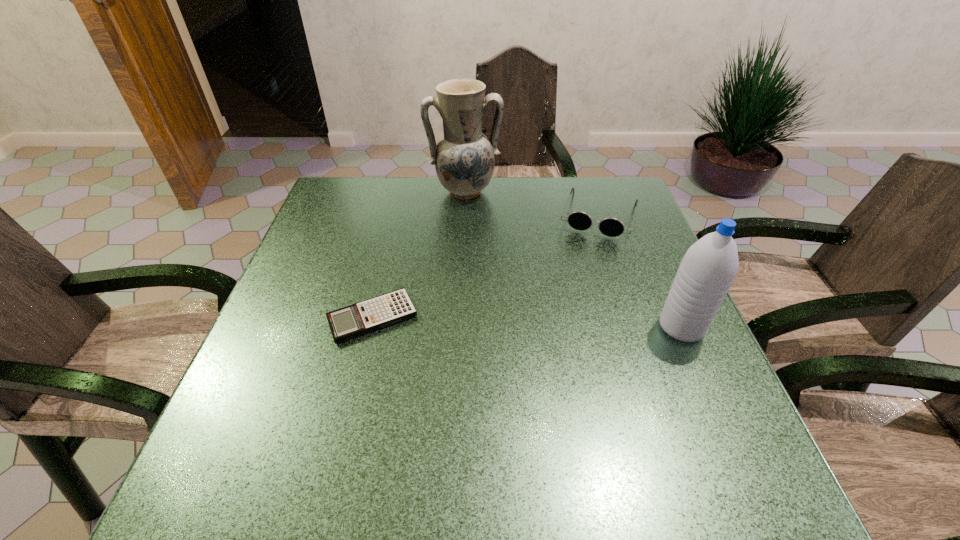
In order to click on the shortest object in this screenshot , I will do `click(379, 312)`.

Locate an element on the screen. Image resolution: width=960 pixels, height=540 pixels. the second tallest object is located at coordinates (707, 270).

Where is `pottery`? Image resolution: width=960 pixels, height=540 pixels. pottery is located at coordinates (464, 161).

Locate an element on the screen. This screenshot has height=540, width=960. the third tallest object is located at coordinates (610, 226).

Where is `vacant space located 0.170m on the back of the shortest object`? This screenshot has height=540, width=960. vacant space located 0.170m on the back of the shortest object is located at coordinates (389, 247).

I want to click on free space located 0.300m on the left of the water bottle, so click(519, 327).

Locate an element on the screen. free space located 0.220m on either side of the pottery is located at coordinates (482, 255).

Image resolution: width=960 pixels, height=540 pixels. In order to click on vacant space located 0.280m on either side of the pottery in this screenshot , I will do `click(486, 271)`.

This screenshot has height=540, width=960. Find the location of `free spot located on either side of the pottery`. free spot located on either side of the pottery is located at coordinates click(472, 219).

You are a GUI agent. You are given a task and a screenshot of the screen. Output one action in this format:
    pyautogui.click(x=<x>, y=<y>)
    Task: Click on the free space located 0.300m on the front-facing side of the sunglasses
    This screenshot has width=960, height=540.
    Given the screenshot: What is the action you would take?
    pyautogui.click(x=568, y=321)